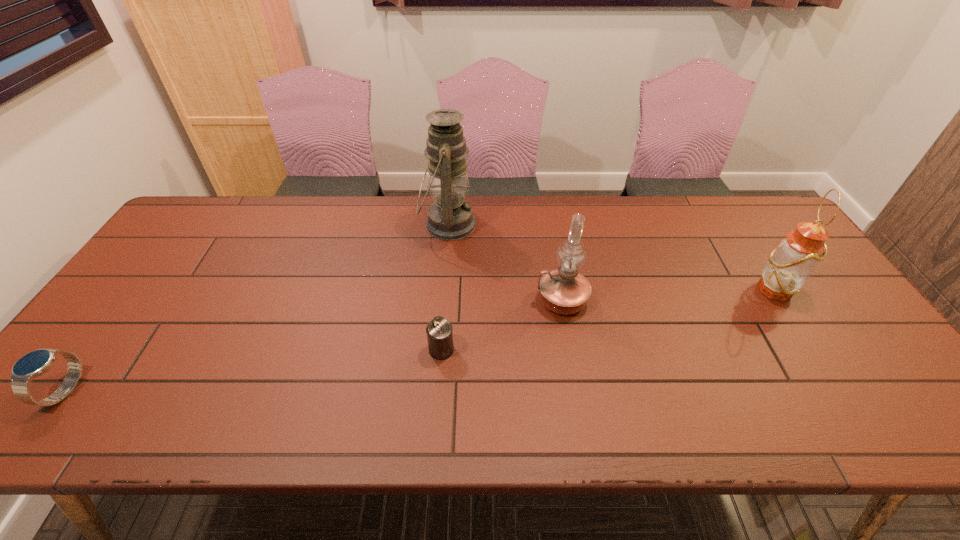
Where is `the tallest oil lamp`? This screenshot has width=960, height=540. the tallest oil lamp is located at coordinates (450, 217).

The image size is (960, 540). In order to click on the farthest object in this screenshot , I will do `click(450, 217)`.

What are the coordinates of `the rightmost oil lamp` in the screenshot? It's located at (789, 266).

At what (x,y) coordinates should I click in order to perform the action: click on the second oil lamp from right to left. Please return your answer as a coordinate pair (x, y). This screenshot has width=960, height=540. Looking at the image, I should click on (564, 291).

You are a GUI agent. You are given a task and a screenshot of the screen. Output one action in this format:
    pyautogui.click(x=<x>, y=<y>)
    Task: Click on the watch
    This screenshot has height=540, width=960.
    Given the screenshot: What is the action you would take?
    pyautogui.click(x=36, y=363)

This screenshot has height=540, width=960. What are the coordinates of `the leftmost object` in the screenshot? It's located at (36, 363).

You are a GUI agent. You are given a task and a screenshot of the screen. Output one action in this format:
    pyautogui.click(x=<x>, y=<y>)
    Task: Click on the can
    
    Given the screenshot: What is the action you would take?
    pyautogui.click(x=439, y=331)

This screenshot has width=960, height=540. I want to click on free space located on the front of the tallest object, so click(x=437, y=357).

I want to click on free spot located on the front of the rightmost object, so click(x=869, y=437).

At what (x,y) coordinates should I click in order to perform the action: click on vacant space situated on the right of the second oil lamp from left to right. Please return your answer as a coordinate pair (x, y). The image size is (960, 540). Looking at the image, I should click on (699, 300).